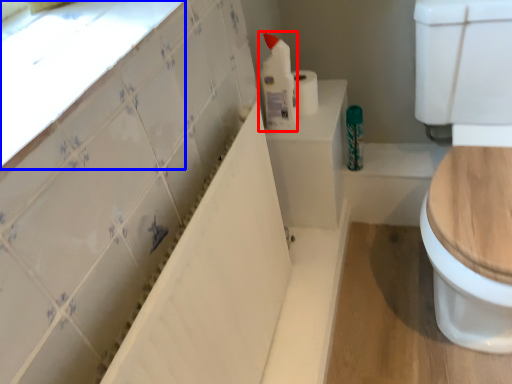
Question: Which point is closer to the camera, cleaning product (highlighted by a red box) or window sill (highlighted by a blue box)?

Choices:
 (A) cleaning product
 (B) window sill

Answer: (B)